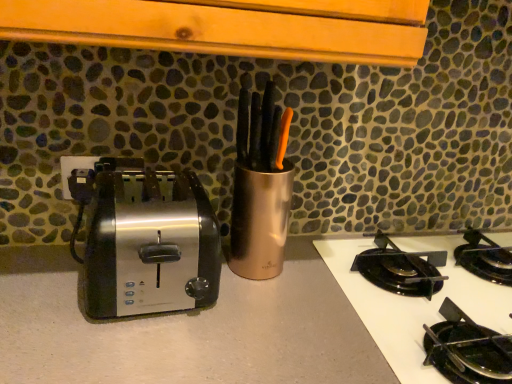
This screenshot has width=512, height=384. I want to click on free space to the right of satin metallic toaster at left, so click(269, 310).